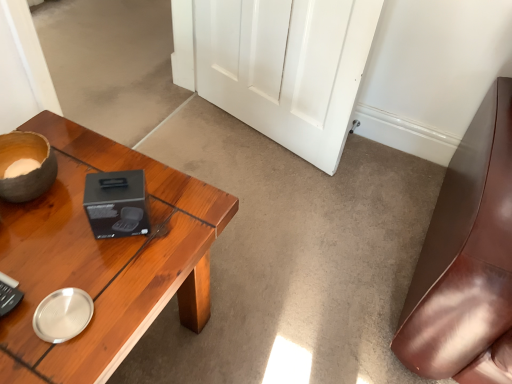
Question: Is white glossy door at center facing away from wooden desk at left?

Choices:
 (A) no
 (B) yes

Answer: (A)

Question: Is white glossy door at center further to camera compared to wooden desk at left?

Choices:
 (A) no
 (B) yes

Answer: (B)

Question: Can you confirm if white glossy door at center is wider than wooden desk at left?

Choices:
 (A) no
 (B) yes

Answer: (A)

Question: From a real-world perspective, is white glossy door at center physically below wooden desk at left?

Choices:
 (A) yes
 (B) no

Answer: (B)

Question: Can you confirm if white glossy door at center is shorter than wooden desk at left?

Choices:
 (A) no
 (B) yes

Answer: (A)

Question: Is white glossy door at center next to wooden desk at left?

Choices:
 (A) yes
 (B) no

Answer: (B)

Question: Is wooden desk at left thinner than white glossy door at center?

Choices:
 (A) yes
 (B) no

Answer: (B)

Question: Is wooden desk at left not near white glossy door at center?

Choices:
 (A) yes
 (B) no

Answer: (B)

Question: Can you confirm if wooden desk at left is shorter than white glossy door at center?

Choices:
 (A) yes
 (B) no

Answer: (A)

Question: Is wooden desk at left turned away from white glossy door at center?

Choices:
 (A) no
 (B) yes

Answer: (A)

Question: From a real-world perspective, is wooden desk at left located beneath white glossy door at center?

Choices:
 (A) yes
 (B) no

Answer: (A)

Question: Considering the relative positions of wooden desk at left and white glossy door at center in the image provided, is wooden desk at left to the left of white glossy door at center from the viewer's perspective?

Choices:
 (A) no
 (B) yes

Answer: (B)

Question: Does point (353, 31) appear closer or farther from the camera than point (150, 253)?

Choices:
 (A) closer
 (B) farther

Answer: (B)